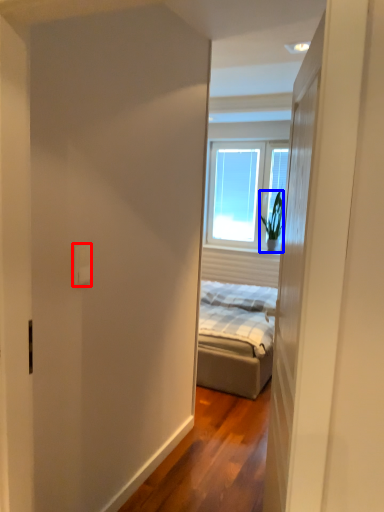
Question: Which object is further to the camera taking this photo, electric outlet (highlighted by a red box) or houseplant (highlighted by a blue box)?

Choices:
 (A) electric outlet
 (B) houseplant

Answer: (B)